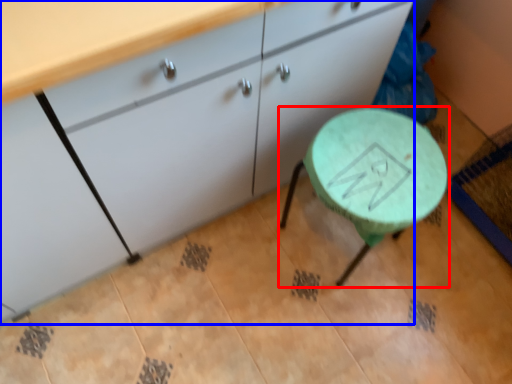
Question: Which object is closer to the camera taking this photo, table (highlighted by a red box) or cabinetry (highlighted by a blue box)?

Choices:
 (A) table
 (B) cabinetry

Answer: (B)